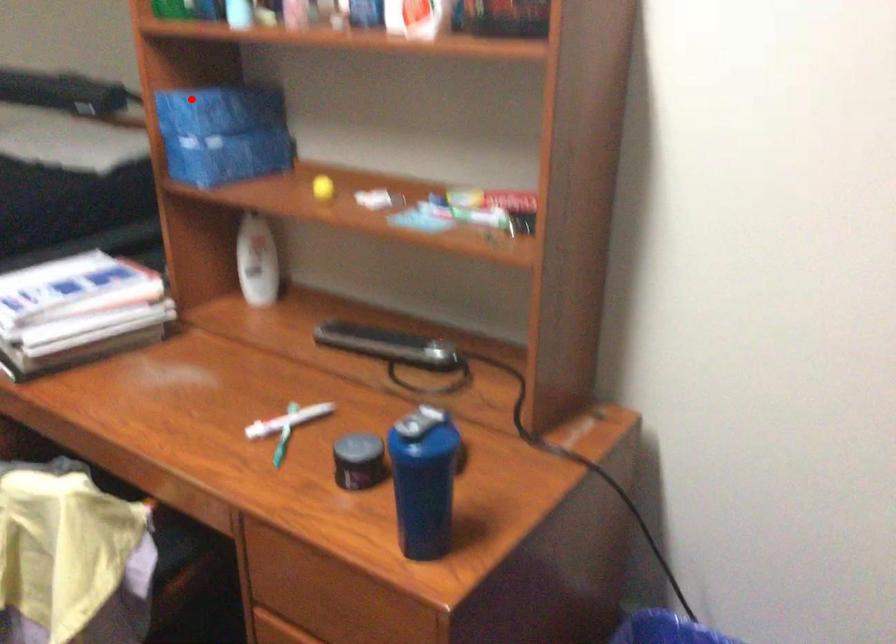
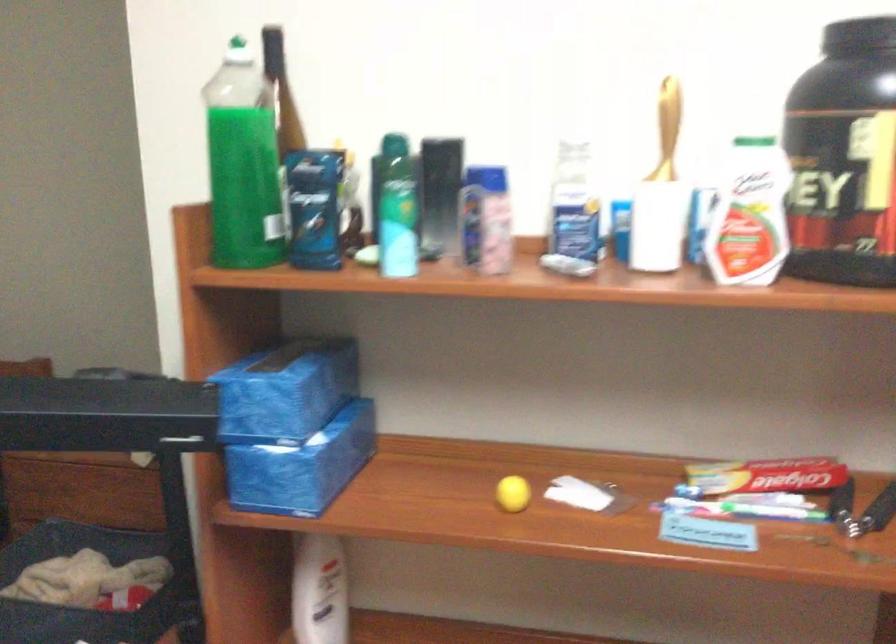
Locate, in the second image, the point that corresponds to the highlighted location in the first image.

(286, 391)